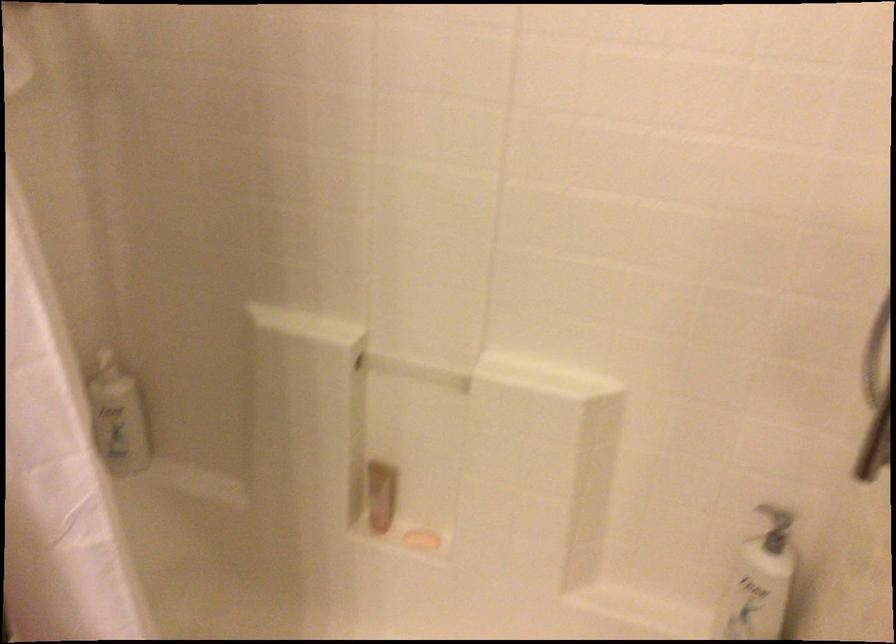
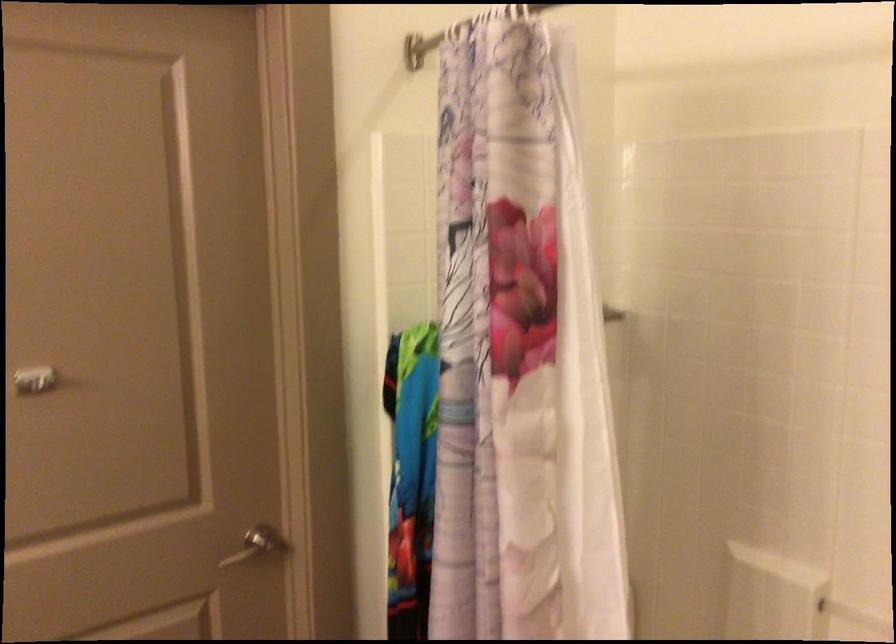
Question: How did the camera likely rotate?

Choices:
 (A) Left
 (B) Right
 (C) Up
 (D) Down

Answer: (A)